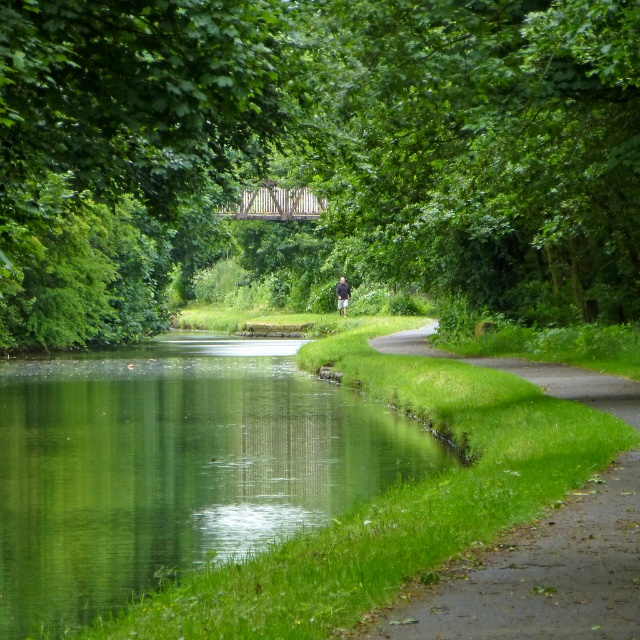
Question: Which point is closer to the camera?

Choices:
 (A) (387, 344)
 (B) (593, 198)
 (C) (337, 296)
 (D) (196, 372)

Answer: (B)

Question: Which point is closer to the camera?

Choices:
 (A) green leafy tree at center
 (B) dark gray jacket at center
 (C) green grassy path at lower right

Answer: (A)

Question: Among these objects, which one is farthest from the camera?

Choices:
 (A) green grassy path at lower right
 (B) green leafy tree at center
 (C) dark gray jacket at center
 (D) green grassy river at lower left

Answer: (C)

Question: Is green leafy tree at center wider than green grassy path at lower right?

Choices:
 (A) no
 (B) yes

Answer: (B)

Question: Can you confirm if green leafy tree at center is smaller than green grassy path at lower right?

Choices:
 (A) no
 (B) yes

Answer: (A)

Question: Does green leafy tree at center appear under green grassy path at lower right?

Choices:
 (A) no
 (B) yes

Answer: (A)